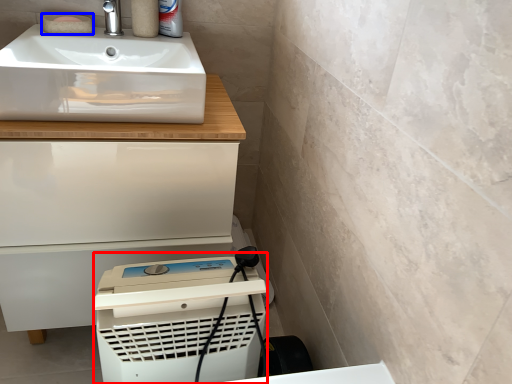
Question: Which of the following is the closest to the observer, appliance (highlighted by a red box) or soap (highlighted by a blue box)?

Choices:
 (A) appliance
 (B) soap

Answer: (A)